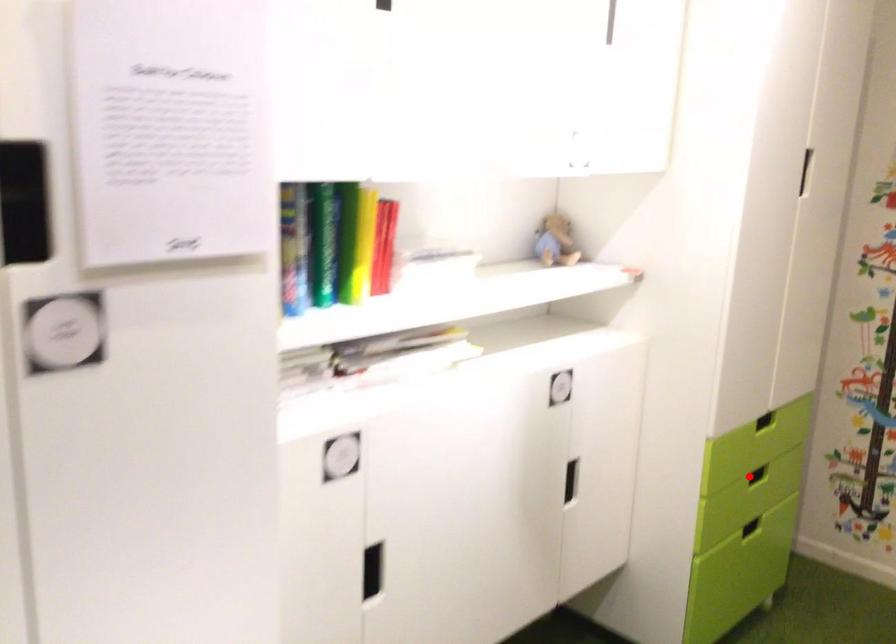
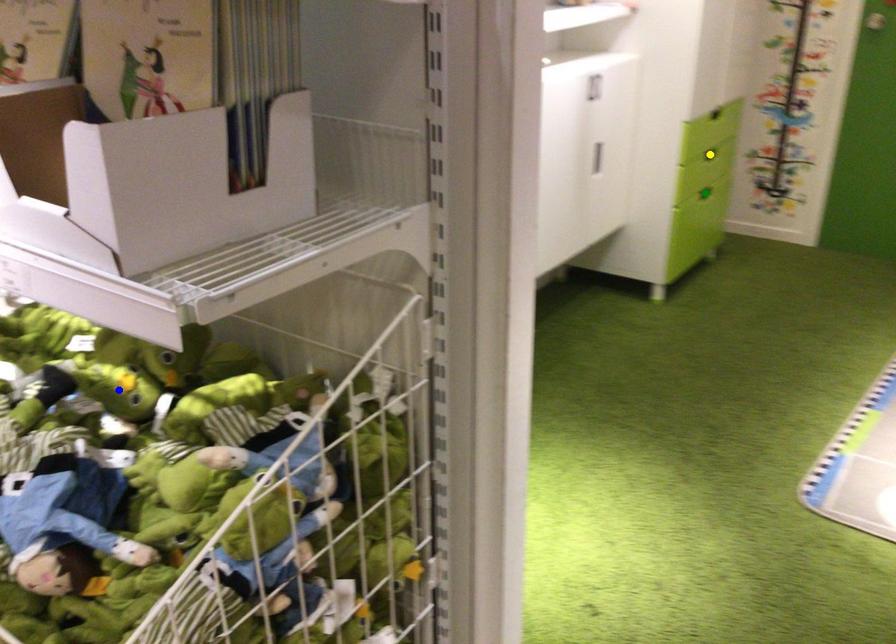
Question: I am providing you with two images of the same scene from different viewpoints. A red point is marked on the first image. You are given multiple points on the second image. Which spot in image 2 lines up with the point in image 1?

Choices:
 (A) blue point
 (B) green point
 (C) yellow point

Answer: (C)